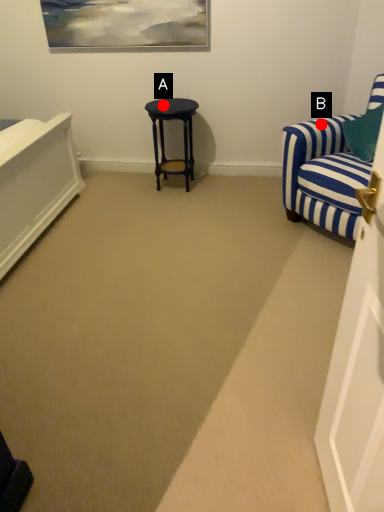
Question: Two points are circled on the image, labeled by A and B beside each circle. Which point is farther from the camera taking this photo?

Choices:
 (A) A is further
 (B) B is further

Answer: (A)